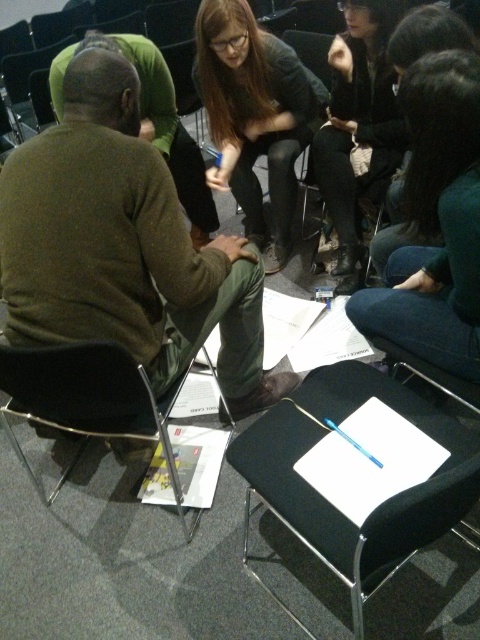
Is dark green sweater at center taller than dark brown sweater at center?

Yes, dark green sweater at center is taller than dark brown sweater at center.

The width and height of the screenshot is (480, 640). What do you see at coordinates (435, 221) in the screenshot?
I see `dark green sweater at center` at bounding box center [435, 221].

You are a GUI agent. You are given a task and a screenshot of the screen. Output one action in this format:
    pyautogui.click(x=<x>, y=<y>)
    Task: Click on the dark green sweater at center
    
    Given the screenshot: What is the action you would take?
    coord(435,221)

At what (x,y) coordinates should I click in order to perform the action: click on dark green sweater at center. Please return your answer as a coordinate pair (x, y). This screenshot has height=640, width=480. Looking at the image, I should click on (435, 221).

Can you confirm if matte brown sweater at left is positioned to the right of matte gray sweater at center?

No, matte brown sweater at left is not to the right of matte gray sweater at center.

Who is higher up, matte brown sweater at left or matte gray sweater at center?

matte gray sweater at center

Who is more distant from viewer, (96,54) or (232,61)?

The point (232,61) is more distant.

At what (x,y) coordinates should I click in order to perform the action: click on matte brown sweater at left. Please return your answer as a coordinate pair (x, y). This screenshot has width=480, height=640. Looking at the image, I should click on (123, 246).

Is dark green sweater at center bigger than matte gray sweater at center?

No.

Is point (436, 259) farther from camera compared to point (268, 124)?

That is False.

This screenshot has width=480, height=640. What do you see at coordinates (435, 221) in the screenshot?
I see `dark green sweater at center` at bounding box center [435, 221].

The image size is (480, 640). Identify the location of dark green sweater at center. (435, 221).